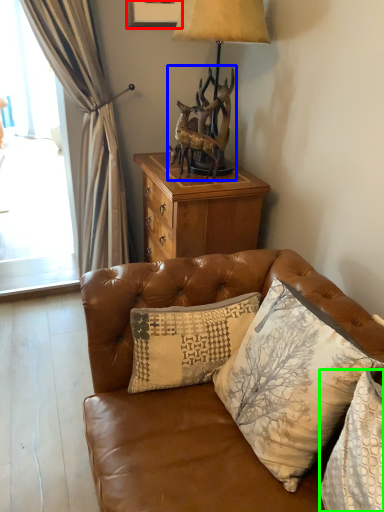
Question: Estimate the real-world distances between objects in this image. Which object is closer to picture frame (highlighted by a red box), animal (highlighted by a blue box) or pillow (highlighted by a green box)?

Choices:
 (A) animal
 (B) pillow

Answer: (A)